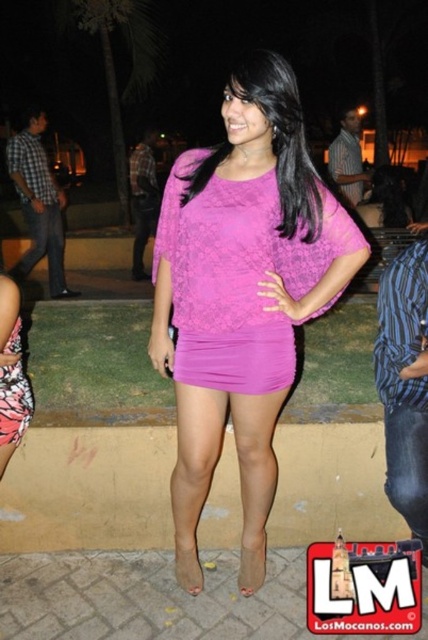
Question: Among these objects, which one is nearest to the camera?

Choices:
 (A) blue striped shirt at right
 (B) pink lace top at center

Answer: (B)

Question: Which object is positioned closest to the matte pink blouse at center?

Choices:
 (A) printed fabric dress at lower left
 (B) lace-like purple dress at center
 (C) pink lace top at center
 (D) blue striped shirt at right

Answer: (B)

Question: From the image, what is the correct spatial relationship of blue striped shirt at right in relation to printed fabric dress at lower left?

Choices:
 (A) right
 (B) left

Answer: (A)

Question: Considering the relative positions of lace-like purple dress at center and printed fabric dress at lower left in the image provided, where is lace-like purple dress at center located with respect to printed fabric dress at lower left?

Choices:
 (A) right
 (B) left

Answer: (A)

Question: Is pink lace top at center positioned before printed fabric dress at lower left?

Choices:
 (A) yes
 (B) no

Answer: (A)

Question: Estimate the real-world distances between objects in this image. Which object is farther from the printed fabric dress at lower left?

Choices:
 (A) pink lace top at center
 (B) blue striped shirt at right
 (C) matte pink blouse at center
 (D) lace-like purple dress at center

Answer: (B)